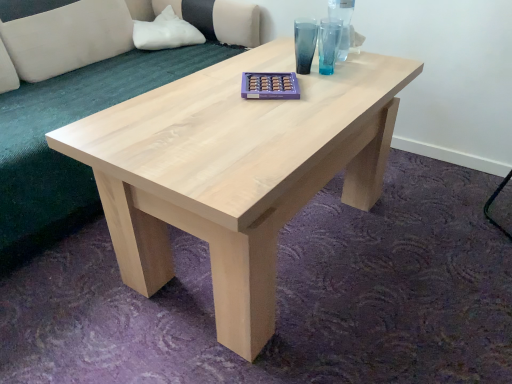
Question: Does natural wood coffee table at center have a larger size compared to light beige fabric couch at upper left?

Choices:
 (A) no
 (B) yes

Answer: (A)

Question: Is natural wood coffee table at center turned away from light beige fabric couch at upper left?

Choices:
 (A) no
 (B) yes

Answer: (A)

Question: Does natural wood coffee table at center have a greater height compared to light beige fabric couch at upper left?

Choices:
 (A) no
 (B) yes

Answer: (A)

Question: Are natural wood coffee table at center and light beige fabric couch at upper left located far from each other?

Choices:
 (A) yes
 (B) no

Answer: (B)

Question: Does natural wood coffee table at center contain light beige fabric couch at upper left?

Choices:
 (A) yes
 (B) no

Answer: (B)

Question: Is point (346, 39) positioned closer to the camera than point (87, 183)?

Choices:
 (A) closer
 (B) farther

Answer: (A)

Question: Is transparent glass vase at upper center situated inside light beige fabric couch at upper left or outside?

Choices:
 (A) outside
 (B) inside

Answer: (A)

Question: From a real-world perspective, is transparent glass vase at upper center above or below light beige fabric couch at upper left?

Choices:
 (A) above
 (B) below

Answer: (A)

Question: Relative to light beige fabric couch at upper left, is transparent glass vase at upper center in front or behind?

Choices:
 (A) behind
 (B) front

Answer: (A)

Question: From a real-world perspective, relative to transparent glass vase at upper center, is light beige fabric couch at upper left vertically above or below?

Choices:
 (A) below
 (B) above

Answer: (A)

Question: In terms of width, does light beige fabric couch at upper left look wider or thinner when compared to transparent glass vase at upper center?

Choices:
 (A) thin
 (B) wide

Answer: (B)

Question: Is light beige fabric couch at upper left inside or outside of transparent glass vase at upper center?

Choices:
 (A) inside
 (B) outside

Answer: (B)

Question: From the image's perspective, is light beige fabric couch at upper left above or below transparent glass vase at upper center?

Choices:
 (A) above
 (B) below

Answer: (B)

Question: Considering the positions of point (348, 14) and point (196, 130), is point (348, 14) closer or farther from the camera than point (196, 130)?

Choices:
 (A) closer
 (B) farther

Answer: (B)

Question: From a real-world perspective, relative to natural wood coffee table at center, is transparent glass vase at upper center vertically above or below?

Choices:
 (A) above
 (B) below

Answer: (A)